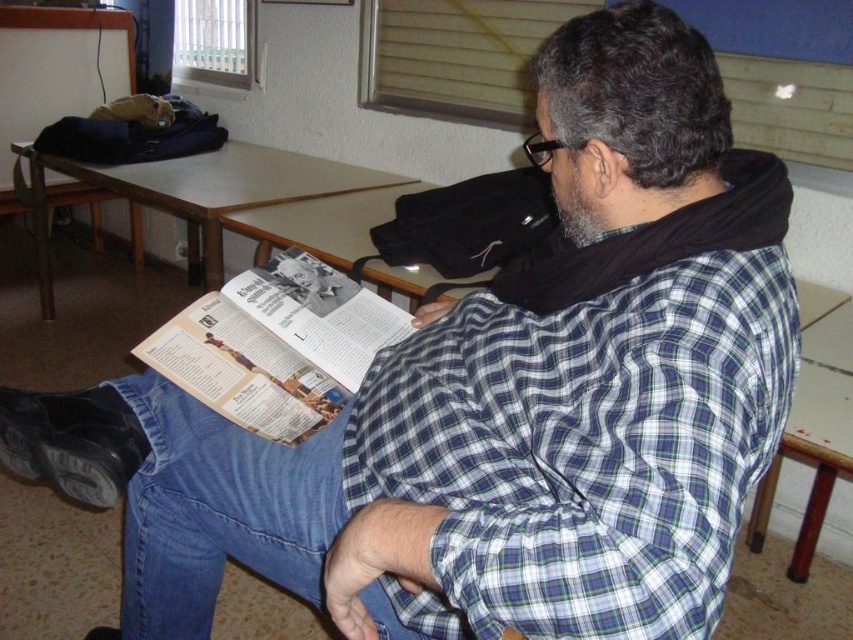
Is green and white checkered shirt at center positioned at the back of printed paper magazine at center?

No, it is not.

Does green and white checkered shirt at center have a smaller size compared to printed paper magazine at center?

Incorrect, green and white checkered shirt at center is not smaller in size than printed paper magazine at center.

Identify the location of green and white checkered shirt at center. The image size is (853, 640). click(x=579, y=451).

At what (x,y) coordinates should I click in order to perform the action: click on green and white checkered shirt at center. Please return your answer as a coordinate pair (x, y). Looking at the image, I should click on (579, 451).

Can you confirm if green and white checkered shirt at center is positioned to the left of wooden chair at lower right?

Yes, green and white checkered shirt at center is to the left of wooden chair at lower right.

Which is behind, point (590, 333) or point (834, 452)?

The point (834, 452) is more distant.

Is point (648, 387) closer to camera compared to point (833, 435)?

Yes.

Locate an element on the screen. The image size is (853, 640). green and white checkered shirt at center is located at coordinates (579, 451).

Can you confirm if printed paper magazine at center is positioned below wooden chair at lower right?

No, printed paper magazine at center is not below wooden chair at lower right.

Between printed paper magazine at center and wooden chair at lower right, which one appears on the left side from the viewer's perspective?

printed paper magazine at center

Does point (138, 348) come farther from viewer compared to point (808, 406)?

No, (138, 348) is in front of (808, 406).

Where is `printed paper magazine at center`? The height and width of the screenshot is (640, 853). printed paper magazine at center is located at coordinates pos(276,344).